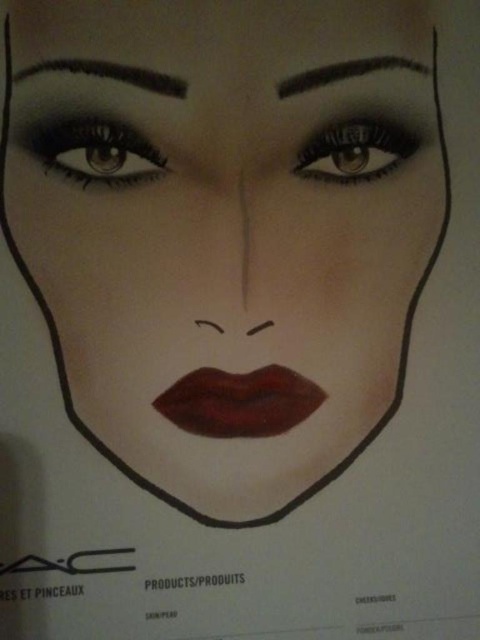
Question: Which object appears closest to the camera in this image?

Choices:
 (A) matte brown lipstick at center
 (B) dark brown matte eyebrow at upper center
 (C) matte brown eye at upper left
 (D) dark brown matte eyebrow at upper left

Answer: (D)

Question: Can you confirm if matte brown lipstick at center is smaller than dark brown matte eyebrow at upper center?

Choices:
 (A) yes
 (B) no

Answer: (B)

Question: Where is shiny black eye at upper center located in relation to dark brown matte eyebrow at upper center in the image?

Choices:
 (A) below
 (B) above

Answer: (A)

Question: Considering the real-world distances, which object is farthest from the dark brown matte eyebrow at upper left?

Choices:
 (A) matte brown eye at upper left
 (B) dark brown matte eyebrow at upper center
 (C) matte brown lipstick at center
 (D) shiny black eye at upper center

Answer: (C)

Question: Which object is farther from the camera taking this photo?

Choices:
 (A) dark brown matte eyebrow at upper center
 (B) matte brown lipstick at center

Answer: (A)

Question: Is matte brown eye at upper left thinner than dark brown matte eyebrow at upper left?

Choices:
 (A) yes
 (B) no

Answer: (A)